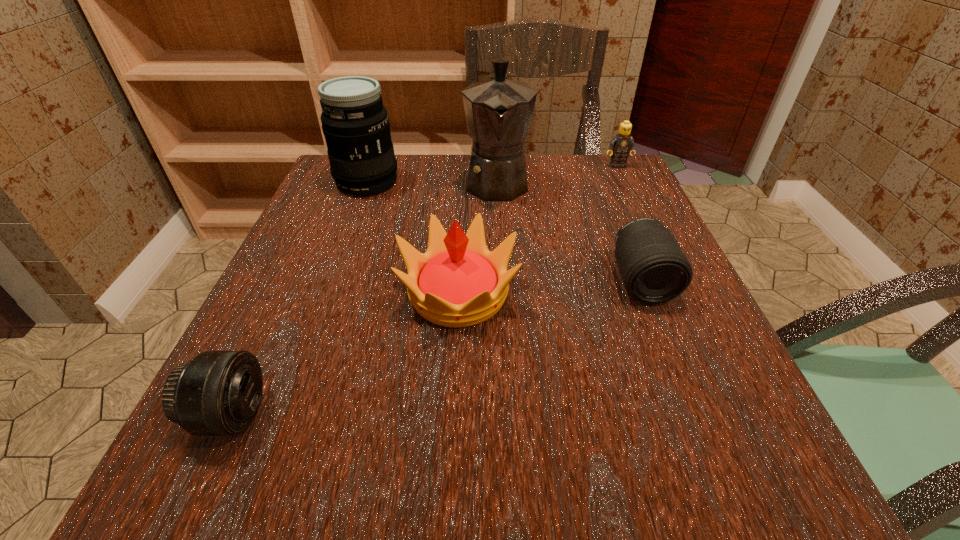
The width and height of the screenshot is (960, 540). I want to click on the tallest object, so click(x=498, y=111).

Identify the location of the tallest telephoto lens. The image size is (960, 540). (355, 123).

Locate an element on the screen. the second tallest object is located at coordinates (355, 123).

Identify the location of crown. (457, 282).

This screenshot has height=540, width=960. In order to click on Lego in this screenshot , I will do `click(620, 145)`.

Locate an element on the screen. The width and height of the screenshot is (960, 540). the rightmost telephoto lens is located at coordinates (654, 269).

Identify the location of the nearest object. (216, 393).

Locate an element on the screen. The image size is (960, 540). vacant space located 0.190m on the pouring side of the tallest object is located at coordinates (501, 267).

The height and width of the screenshot is (540, 960). What are the coordinates of `free space located 0.220m on the right of the tallest telephoto lens` in the screenshot? It's located at (492, 181).

Where is `vacant space located on the right of the third tallest object`? vacant space located on the right of the third tallest object is located at coordinates (569, 293).